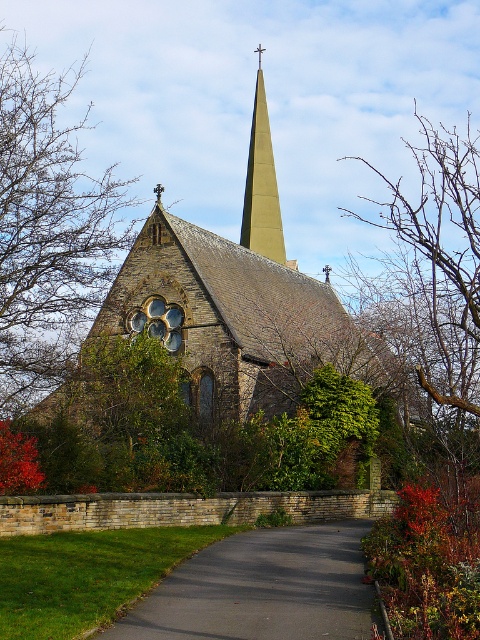
Question: Which point appears closest to the camera in this image?

Choices:
 (A) (60, 256)
 (B) (455, 128)
 (C) (279, 221)

Answer: (A)

Question: Which of the following is the closest to the observer?

Choices:
 (A) click(x=41, y=305)
 (B) click(x=139, y=624)
 (C) click(x=415, y=113)
 (D) click(x=275, y=192)

Answer: (B)

Question: Does black asphalt path at center appear on the right side of bare branches at upper center?

Choices:
 (A) no
 (B) yes

Answer: (A)

Question: Can you confirm if green leafy tree at left is smaller than bare branches at upper center?

Choices:
 (A) yes
 (B) no

Answer: (A)

Question: Does bare branches at upper center have a smaller size compared to green smooth steeple at center?

Choices:
 (A) yes
 (B) no

Answer: (B)

Question: Which of these objects is positioned closest to the bare branches at upper center?

Choices:
 (A) green smooth steeple at center
 (B) green leafy tree at left
 (C) black asphalt path at center

Answer: (A)